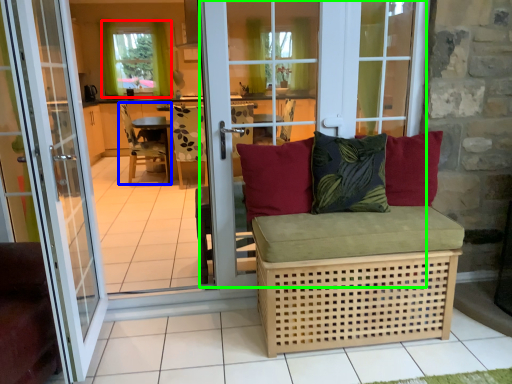
Question: Which is nearer to the window (highlighted by a red box)? chair (highlighted by a blue box) or glass door (highlighted by a green box).

Choices:
 (A) chair
 (B) glass door

Answer: (A)